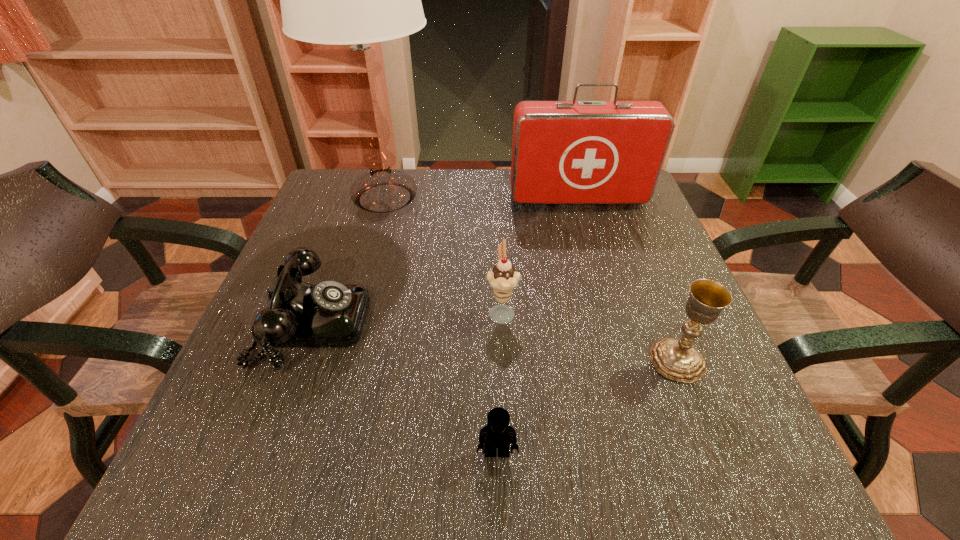
Find the location of a particular element. table lamp is located at coordinates 339,0.

In order to click on the first-aid kit in this screenshot , I will do `click(563, 152)`.

You are a GUI agent. You are given a task and a screenshot of the screen. Output one action in this format:
    pyautogui.click(x=<x>, y=<y>)
    Task: Click on the chalice
    The width and height of the screenshot is (960, 540).
    Given the screenshot: What is the action you would take?
    (677, 359)

The image size is (960, 540). I want to click on icecream, so click(x=503, y=278).

Image resolution: width=960 pixels, height=540 pixels. I want to click on telephone, so click(328, 314).

Locate an element on the screen. Image resolution: width=960 pixels, height=540 pixels. Lego is located at coordinates (498, 434).

The height and width of the screenshot is (540, 960). I want to click on the shortest object, so click(x=498, y=434).

The width and height of the screenshot is (960, 540). Identify the location of vacant region located on the front-facing side of the tallest object. (584, 198).

Identify the location of vacant space situated 0.180m on the side of the fifth shortest object with the first aid cross symbol. (594, 256).

Image resolution: width=960 pixels, height=540 pixels. Identify the location of vacant space located on the left of the chalice. (534, 360).